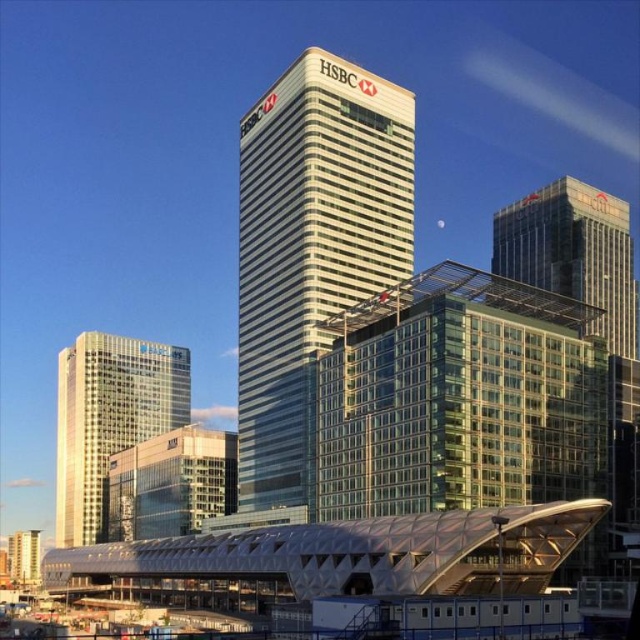
Question: Considering the relative positions of white glass skyscraper at center and metallic glass building at lower left in the image provided, where is white glass skyscraper at center located with respect to metallic glass building at lower left?

Choices:
 (A) left
 (B) right

Answer: (B)

Question: Does white glass skyscraper at center lie behind clear glass skyscraper at upper right?

Choices:
 (A) no
 (B) yes

Answer: (B)

Question: Is clear glass skyscraper at upper right smaller than metallic glass building at lower left?

Choices:
 (A) no
 (B) yes

Answer: (A)

Question: Which of the following is the closest to the observer?

Choices:
 (A) (611, 285)
 (B) (161, 417)
 (C) (250, 264)
 (D) (24, 557)

Answer: (C)

Question: Which of these objects is positioned farthest from the clear glass skyscraper at upper right?

Choices:
 (A) metallic glass building at lower left
 (B) white glass building at left

Answer: (A)

Question: Which of the following is the closest to the observer?

Choices:
 (A) (252, 301)
 (B) (612, 307)
 (C) (116, 440)
 (D) (19, 552)

Answer: (A)